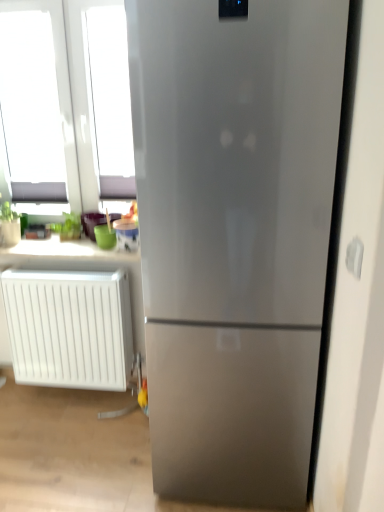
Where is `vacant space in white plastic radiator at lower left (from a real-world perspective)`? The height and width of the screenshot is (512, 384). vacant space in white plastic radiator at lower left (from a real-world perspective) is located at coordinates (66, 394).